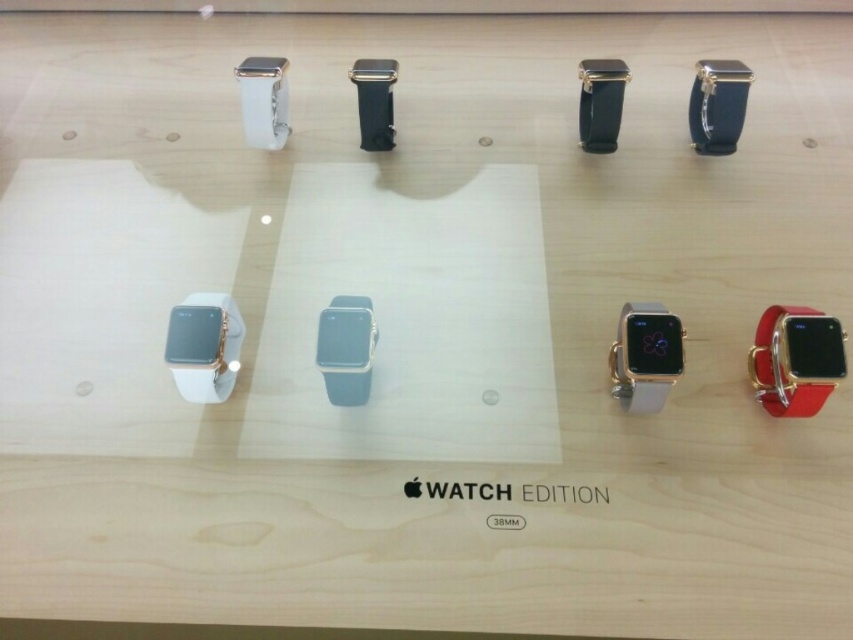
Who is positioned more to the right, gold metallic watch at center-right or white matte watch at upper left?

gold metallic watch at center-right

Who is taller, gold metallic watch at center-right or white matte watch at upper left?

With more height is gold metallic watch at center-right.

Describe the element at coordinates (645, 356) in the screenshot. The image size is (853, 640). I see `gold metallic watch at center-right` at that location.

The height and width of the screenshot is (640, 853). I want to click on gold metallic watch at center-right, so click(645, 356).

Where is `satin silver watch at center`? satin silver watch at center is located at coordinates (346, 348).

Looking at this image, between satin silver watch at center and white matte watch at upper left, which one appears on the right side from the viewer's perspective?

satin silver watch at center is more to the right.

Identify the location of satin silver watch at center. (346, 348).

Identify the location of satin silver watch at center. click(346, 348).

Is satin silver watch at center positioned behind satin black watch at upper right?

No.

Does satin silver watch at center appear on the left side of satin black watch at upper right?

Yes, satin silver watch at center is to the left of satin black watch at upper right.

Is point (334, 381) positioned after point (695, 109)?

That is False.

The width and height of the screenshot is (853, 640). I want to click on satin silver watch at center, so click(x=346, y=348).